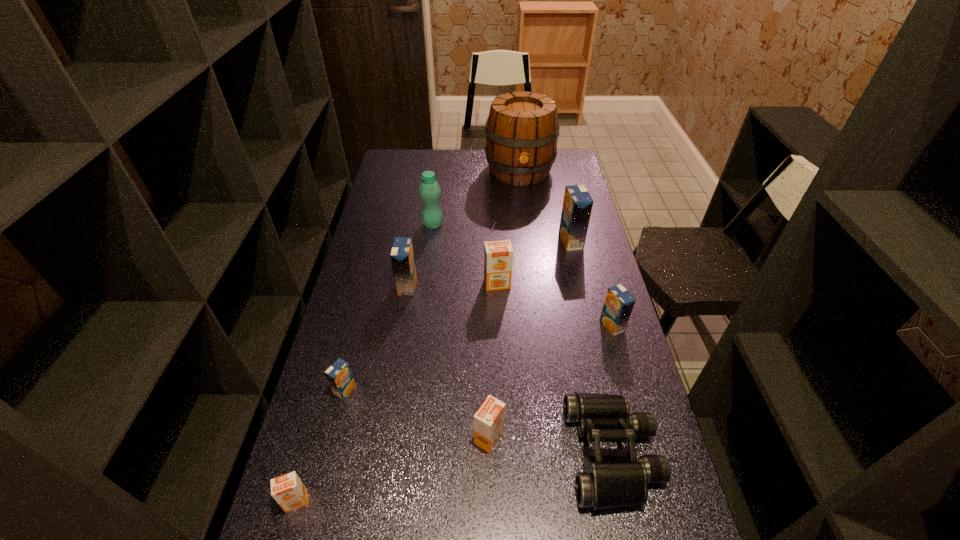
Identify the location of vacant area located on the right of the second blue orange_juice from left to right. (526, 286).

Locate an element on the screen. vacant area located on the front of the farthest orange orange juice is located at coordinates (499, 343).

The height and width of the screenshot is (540, 960). I want to click on vacant area located 0.170m on the front of the fourth nearest orange juice, so click(629, 383).

The height and width of the screenshot is (540, 960). Identify the location of vacant area situated 0.080m on the right of the second smallest orange orange juice. (536, 437).

Image resolution: width=960 pixels, height=540 pixels. I want to click on free point located 0.170m on the front-facing side of the binoculars, so click(x=501, y=453).

The width and height of the screenshot is (960, 540). Find the location of `vacant space positioned 0.270m on the front-facing side of the binoculars`. vacant space positioned 0.270m on the front-facing side of the binoculars is located at coordinates (461, 453).

Locate an element on the screen. vacant space positioned on the front-facing side of the binoculars is located at coordinates (501, 453).

Where is `free region located 0.110m on the front of the leftmost blue orange_juice`? The image size is (960, 540). free region located 0.110m on the front of the leftmost blue orange_juice is located at coordinates (333, 439).

Where is `blank space located 0.380m on the back of the nearest orange orange juice`? Image resolution: width=960 pixels, height=540 pixels. blank space located 0.380m on the back of the nearest orange orange juice is located at coordinates (337, 356).

You are a GUI agent. You are given a task and a screenshot of the screen. Output one action in this format:
    pyautogui.click(x=<x>, y=<y>)
    Task: Click on the object at the far edge
    The image size is (960, 540).
    Given the screenshot: What is the action you would take?
    pyautogui.click(x=522, y=129)